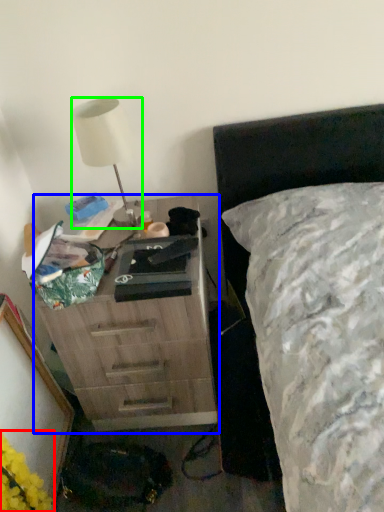
Question: Which is farther away from flower (highlighted by a red box)? chest of drawers (highlighted by a blue box) or lamp (highlighted by a green box)?

Choices:
 (A) chest of drawers
 (B) lamp

Answer: (B)